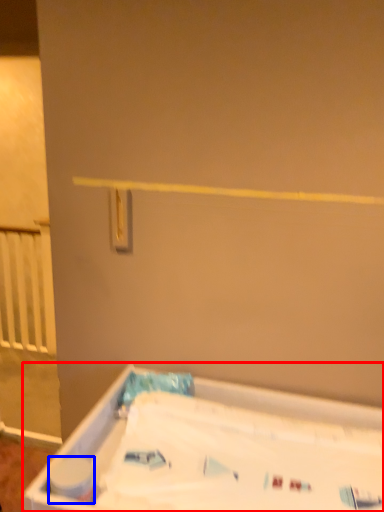
Question: Which object is closer to the camera taking this photo, bathtub (highlighted by a red box) or toilet paper (highlighted by a blue box)?

Choices:
 (A) bathtub
 (B) toilet paper

Answer: (A)